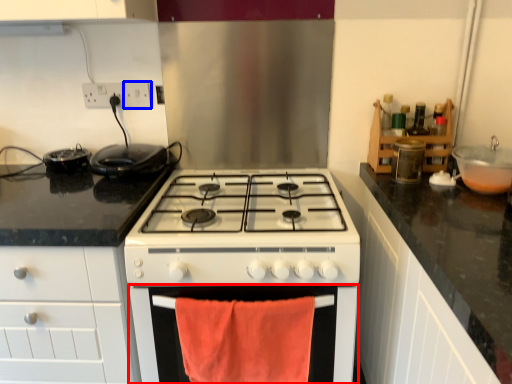
Question: Which point is closer to the camera, oven (highlighted by a red box) or electric outlet (highlighted by a blue box)?

Choices:
 (A) oven
 (B) electric outlet

Answer: (A)